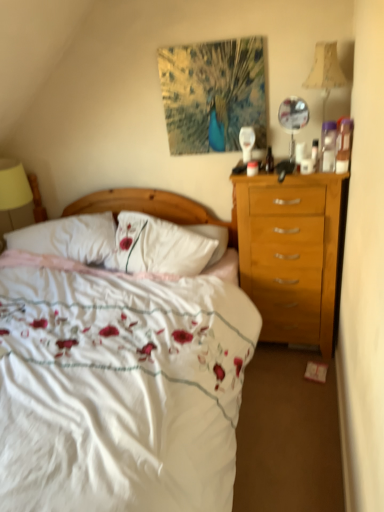
Locate an element on the screen. This screenshot has width=384, height=512. beige fabric lampshade at upper right is located at coordinates (325, 72).

Does white floral duvet at center lie in front of beige fabric lampshade at upper right?

Yes, white floral duvet at center is closer to the camera.

Between white floral duvet at center and beige fabric lampshade at upper right, which one has larger width?

With larger width is white floral duvet at center.

Considering the relative sizes of white floral duvet at center and beige fabric lampshade at upper right in the image provided, is white floral duvet at center taller than beige fabric lampshade at upper right?

Yes.

Could you tell me if white floral duvet at center is facing beige fabric lampshade at upper right?

No, white floral duvet at center is not turned towards beige fabric lampshade at upper right.

Is point (316, 72) positioned in front of point (76, 213)?

Yes, it is.

Which of these two, beige fabric lampshade at upper right or wooden headboard at center, stands taller?

wooden headboard at center is taller.

Can you confirm if beige fabric lampshade at upper right is wider than wooden headboard at center?

Correct, the width of beige fabric lampshade at upper right exceeds that of wooden headboard at center.

Is white soft pillow at center far from wooden headboard at center?

No, white soft pillow at center is not far from wooden headboard at center.

Considering the sizes of objects white soft pillow at center and wooden headboard at center in the image provided, who is thinner, white soft pillow at center or wooden headboard at center?

wooden headboard at center.

In terms of height, does white soft pillow at center look taller or shorter compared to wooden headboard at center?

In the image, white soft pillow at center appears to be shorter than wooden headboard at center.

Between white soft pillow at center and beige fabric lampshade at upper right, which one has larger size?

white soft pillow at center is bigger.

Is white soft pillow at center not inside beige fabric lampshade at upper right?

Yes.

From the image's perspective, is white soft pillow at center located above or below beige fabric lampshade at upper right?

Based on their image positions, white soft pillow at center is located beneath beige fabric lampshade at upper right.

From the image's perspective, which one is positioned higher, wooden headboard at center or white floral duvet at center?

wooden headboard at center is shown above in the image.

Which is in front, wooden headboard at center or white floral duvet at center?

white floral duvet at center is more forward.

From a real-world perspective, which object stands above the other?

From a 3D spatial view, wooden headboard at center is above.

Can you confirm if wooden headboard at center is positioned to the left of white floral duvet at center?

In fact, wooden headboard at center is to the right of white floral duvet at center.

Is the surface of wooden headboard at center in direct contact with beige fabric lampshade at upper right?

There is a gap between wooden headboard at center and beige fabric lampshade at upper right.

From the image's perspective, relative to beige fabric lampshade at upper right, is wooden headboard at center above or below?

wooden headboard at center is situated lower than beige fabric lampshade at upper right in the image.

Does wooden headboard at center appear on the left side of beige fabric lampshade at upper right?

Yes.

Is wooden headboard at center oriented towards beige fabric lampshade at upper right?

No, wooden headboard at center is not oriented towards beige fabric lampshade at upper right.

Is white floral duvet at center smaller than wooden headboard at center?

Actually, white floral duvet at center might be larger than wooden headboard at center.

Identify the location of headboard behind the white floral duvet at center. The height and width of the screenshot is (512, 384). (155, 209).

Do you think white floral duvet at center is within wooden headboard at center, or outside of it?

white floral duvet at center is outside wooden headboard at center.

From a real-world perspective, is white floral duvet at center over wooden headboard at center?

No, from a real-world perspective, white floral duvet at center is not on top of wooden headboard at center.

Where is `bed that is below the beige fabric lampshade at upper right (from the image's perspective)`? bed that is below the beige fabric lampshade at upper right (from the image's perspective) is located at coordinates (119, 387).

Where is `bedside lamp that appears above the wooden headboard at center (from a real-world perspective)`? The image size is (384, 512). bedside lamp that appears above the wooden headboard at center (from a real-world perspective) is located at coordinates (325, 72).

From the image, which object appears to be nearer to beige fabric lampshade at upper right, wooden headboard at center or white floral duvet at center?

wooden headboard at center.

Looking at the image, which one is located further to wooden headboard at center, beige fabric lampshade at upper right or white soft pillow at center?

→ beige fabric lampshade at upper right lies further to wooden headboard at center than the other object.

When comparing their distances from white soft pillow at center, does wooden headboard at center or beige fabric lampshade at upper right seem further?

beige fabric lampshade at upper right lies further to white soft pillow at center than the other object.

From the image, which object appears to be nearer to wooden headboard at center, white floral duvet at center or beige fabric lampshade at upper right?

The object closer to wooden headboard at center is white floral duvet at center.

Estimate the real-world distances between objects in this image. Which object is closer to wooden headboard at center, white soft pillow at center or white floral duvet at center?

white soft pillow at center is positioned closer to the anchor wooden headboard at center.

Which object lies further to the anchor point beige fabric lampshade at upper right, white soft pillow at center or white floral duvet at center?

white soft pillow at center lies further to beige fabric lampshade at upper right than the other object.

From the picture: From the image, which object appears to be nearer to beige fabric lampshade at upper right, white floral duvet at center or white soft pillow at center?

white floral duvet at center lies closer to beige fabric lampshade at upper right than the other object.

Estimate the real-world distances between objects in this image. Which object is closer to wooden headboard at center, beige fabric lampshade at upper right or white floral duvet at center?

white floral duvet at center lies closer to wooden headboard at center than the other object.

Find the location of a particular element. The height and width of the screenshot is (512, 384). bedside lamp located between white floral duvet at center and wooden headboard at center in the depth direction is located at coordinates pos(325,72).

Locate an element on the screen. Image resolution: width=384 pixels, height=512 pixels. headboard situated between white soft pillow at center and beige fabric lampshade at upper right from left to right is located at coordinates (155, 209).

Locate an element on the screen. bedside lamp between white floral duvet at center and white soft pillow at center from front to back is located at coordinates (325, 72).

The height and width of the screenshot is (512, 384). I want to click on headboard between white floral duvet at center and white soft pillow at center in the front-back direction, so 155,209.